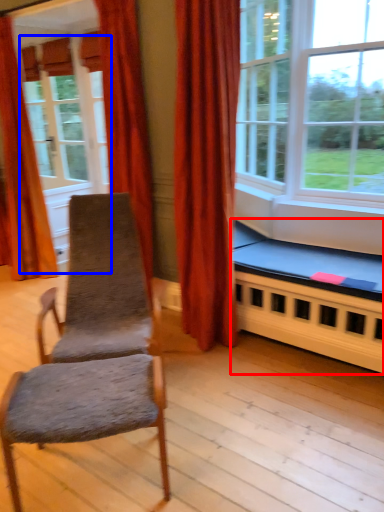
Question: Which of the following is the closest to the observer, bed frame (highlighted by a red box) or screen door (highlighted by a blue box)?

Choices:
 (A) bed frame
 (B) screen door

Answer: (A)